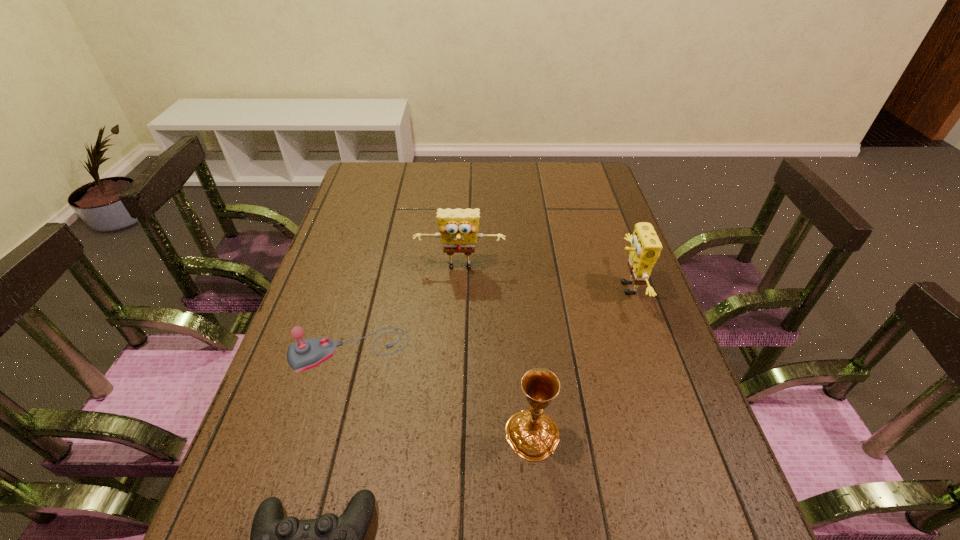
I want to click on the right sponge, so click(x=645, y=249).

The image size is (960, 540). In order to click on the left sponge in this screenshot , I will do `click(458, 228)`.

The image size is (960, 540). I want to click on the fourth farthest object, so click(x=533, y=435).

You are a GUI agent. You are given a task and a screenshot of the screen. Output one action in this format:
    pyautogui.click(x=<x>, y=<y>)
    Task: Click on the joystick
    The height and width of the screenshot is (540, 960).
    Given the screenshot: What is the action you would take?
    pyautogui.click(x=302, y=355)

The width and height of the screenshot is (960, 540). I want to click on the fourth tallest object, so click(x=302, y=355).

Locate an element on the screen. The width and height of the screenshot is (960, 540). free region located 0.050m on the face of the rightmost object is located at coordinates (596, 288).

Where is `vacant space positioned 0.220m on the face of the rightmost object`? The image size is (960, 540). vacant space positioned 0.220m on the face of the rightmost object is located at coordinates click(x=534, y=288).

Locate an element on the screen. The image size is (960, 540). vacant space positioned 0.220m on the face of the rightmost object is located at coordinates (534, 288).

In order to click on vacant space located on the face of the left sponge in this screenshot , I will do `click(458, 312)`.

Find the location of a particular element. vacant space positioned 0.240m on the left of the chalice is located at coordinates (388, 435).